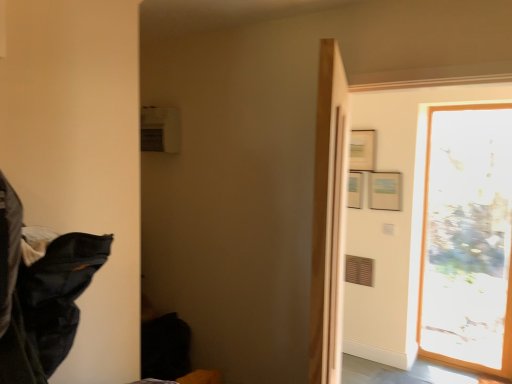
Question: Is transparent glass door at right further to camera compared to black fabric at left?

Choices:
 (A) yes
 (B) no

Answer: (A)

Question: Is transparent glass door at right beside black fabric at left?

Choices:
 (A) yes
 (B) no

Answer: (B)

Question: Is transparent glass door at right taller than black fabric at left?

Choices:
 (A) no
 (B) yes

Answer: (B)

Question: Could you tell me if transparent glass door at right is facing black fabric at left?

Choices:
 (A) yes
 (B) no

Answer: (A)

Question: From a real-world perspective, is transparent glass door at right physically above black fabric at left?

Choices:
 (A) yes
 (B) no

Answer: (B)

Question: From the image's perspective, is transparent glass door at right beneath black fabric at left?

Choices:
 (A) yes
 (B) no

Answer: (A)

Question: Is the depth of black fabric at left less than that of transparent glass door at right?

Choices:
 (A) yes
 (B) no

Answer: (A)

Question: Is black fabric at left turned away from transparent glass door at right?

Choices:
 (A) yes
 (B) no

Answer: (B)

Question: Is black fabric at left thinner than transparent glass door at right?

Choices:
 (A) no
 (B) yes

Answer: (A)

Question: Can you confirm if black fabric at left is positioned to the right of transparent glass door at right?

Choices:
 (A) yes
 (B) no

Answer: (B)

Question: Does black fabric at left turn towards transparent glass door at right?

Choices:
 (A) yes
 (B) no

Answer: (B)

Question: Can you confirm if black fabric at left is bigger than transparent glass door at right?

Choices:
 (A) no
 (B) yes

Answer: (A)

Question: From the image's perspective, is black fabric at left located above or below transparent glass door at right?

Choices:
 (A) below
 (B) above

Answer: (B)